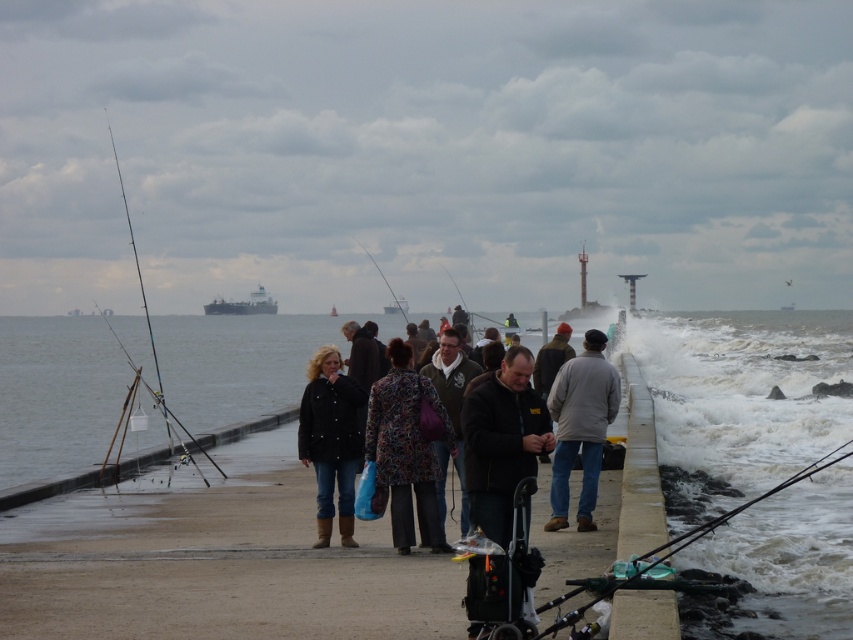
You are a photographer trying to capture the entire metallic gray ship at center and the gray water at center in a single frame. Based on the scene, will the ship or the water take up more space in the photo?

The gray water at center takes up more space in the photo because its width is larger than that of the metallic gray ship at center.

You are a photographer trying to capture both the matte black fishing pole at center and the metallic gray ship at center in the same frame. Which object should you focus on first if you want to ensure both are in focus without adjusting your camera settings?

The matte black fishing pole at center is taller than the metallic gray ship at center, so focusing on the taller object first would help ensure both are in focus as they are at different distances.